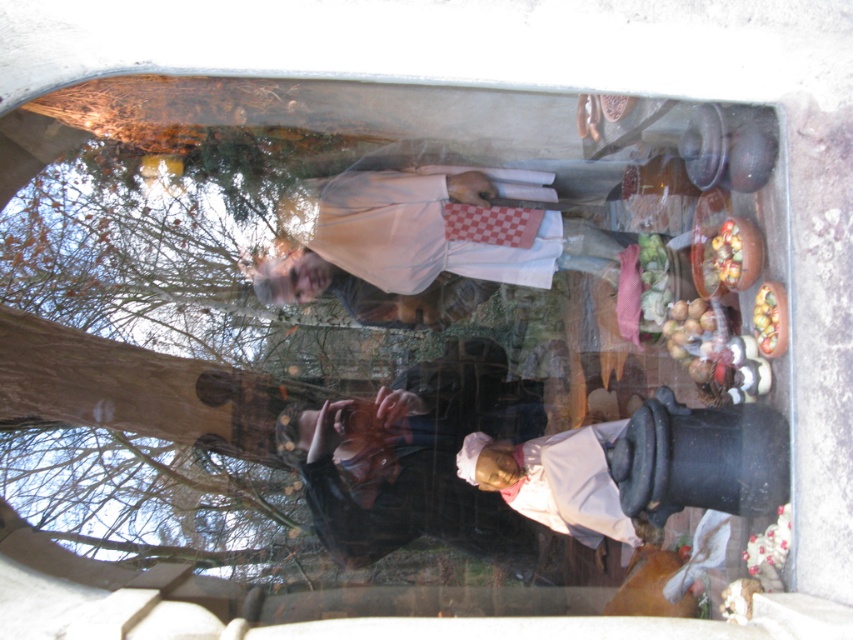
Is point (581, 520) positioned before point (752, 314)?

No, (581, 520) is further to viewer.

Identify the location of matte white chef hat at center. click(x=659, y=467).

Find the location of `matte white chef hat at center`. matte white chef hat at center is located at coordinates (659, 467).

Is point (729, 496) closer to camera compared to point (734, 280)?

Yes, point (729, 496) is closer to viewer.

Which is in front, point (721, 456) or point (729, 221)?

Positioned in front is point (721, 456).

At what (x,y) coordinates should I click in order to perform the action: click on matte white chef hat at center. Please return your answer as a coordinate pair (x, y). Looking at the image, I should click on (659, 467).

What are the coordinates of `matte white chef hat at center` in the screenshot? It's located at (659, 467).

Is pink fabric headscarf at center below shiny metallic bowl at right?

Correct, pink fabric headscarf at center is located below shiny metallic bowl at right.

Locate an element on the screen. The height and width of the screenshot is (640, 853). pink fabric headscarf at center is located at coordinates point(424,461).

The width and height of the screenshot is (853, 640). Find the location of `pink fabric headscarf at center`. pink fabric headscarf at center is located at coordinates click(x=424, y=461).